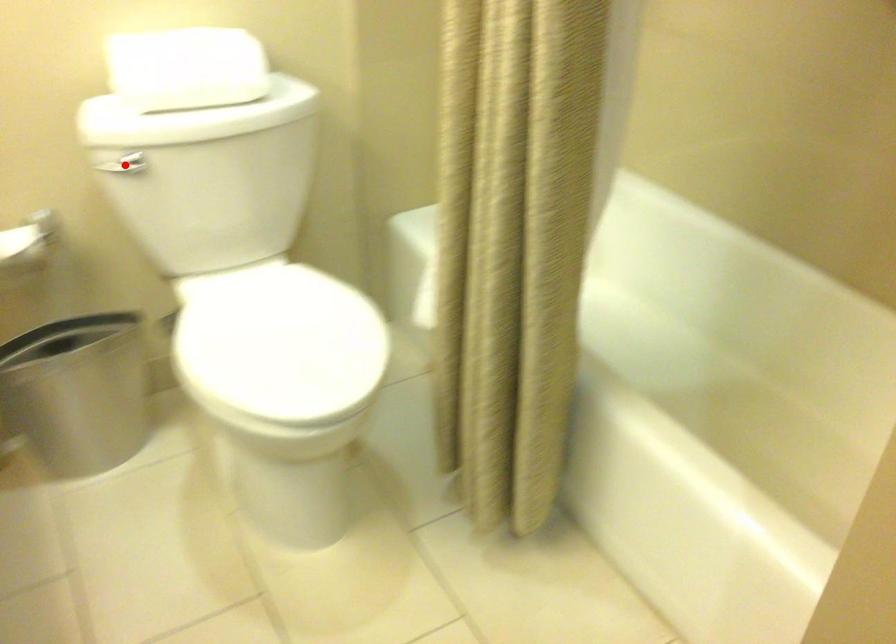
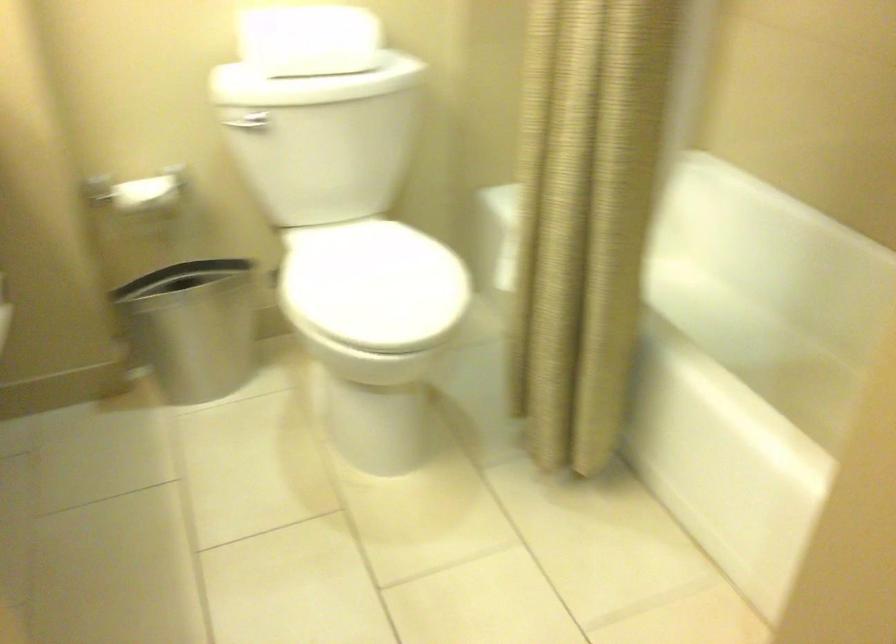
Question: I am providing you with two images of the same scene from different viewpoints. In image1, a red point is highlighted. Considering the same 3D point in image2, which of the following is correct?

Choices:
 (A) It is closer
 (B) It is farther

Answer: (B)